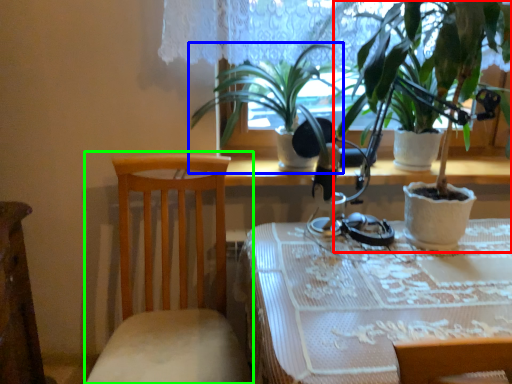
Question: Estimate the real-world distances between objects in this image. Which object is closer to houseplant (highlighted by a red box), houseplant (highlighted by a blue box) or chair (highlighted by a green box)?

Choices:
 (A) houseplant
 (B) chair

Answer: (A)